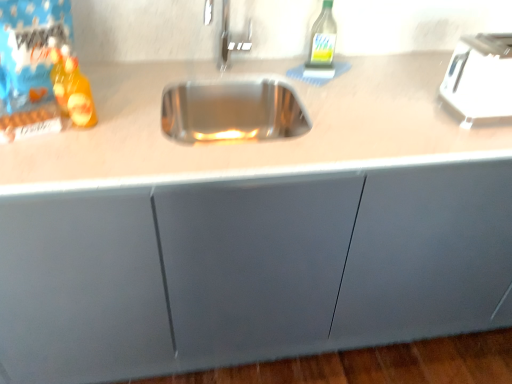
You are a GUI agent. You are given a task and a screenshot of the screen. Output one action in this format:
    pyautogui.click(x=<x>, y=<y>)
    Task: Click on the free space that is to the left of white plastic toaster at upper right
    
    Given the screenshot: What is the action you would take?
    pyautogui.click(x=408, y=110)